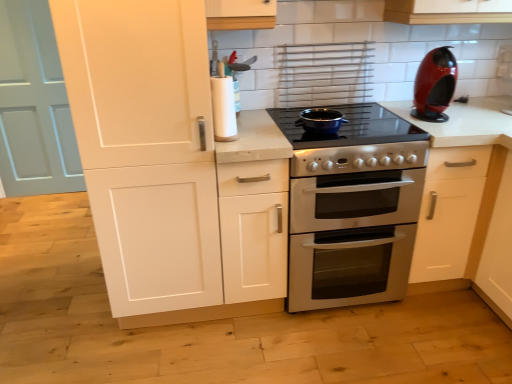
I want to click on free spot in front of light blue wood door at left, so click(x=34, y=211).